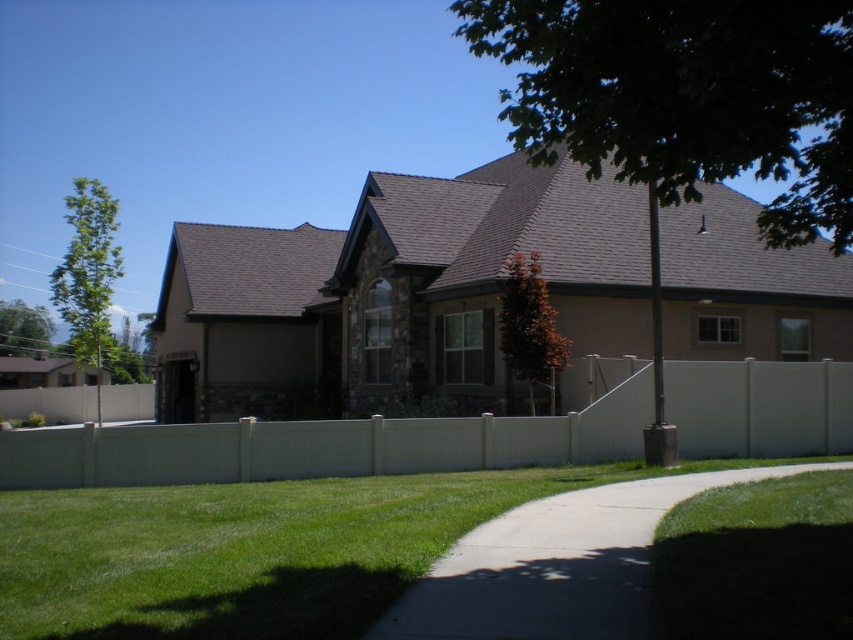
You are a gardener who needs to mow the lawn. You are currently standing on the concrete pathway. Which direction should you move to reach the green grass at lower left first before approaching the white vinyl fence at center?

The green grass at lower left is positioned on the left side of the white vinyl fence at center, so you should move to the left from the concrete pathway to reach the green grass at lower left before approaching the white vinyl fence at center.

You are standing at the edge of the green grass at lower left and want to walk to the entrance of the house. Which direction should you go relative to the white vinyl fence at center?

The green grass at lower left is in front of the white vinyl fence at center, so you should walk towards the white vinyl fence at center to reach the entrance of the house.